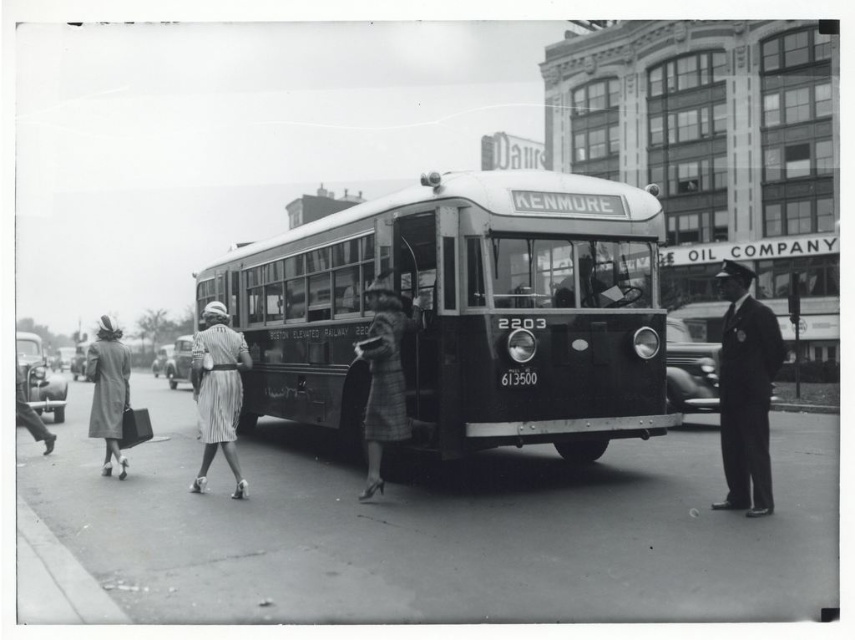
Based on the photo, you are a fashion designer observing the urban scene. You notice the plaid wool skirt at center and the matte gray coat at left. Which clothing item appears taller in the photograph?

The plaid wool skirt at center is taller than the matte gray coat at left according to the description.

You are a delivery person trying to park your 1.5 meter wide delivery van between the metallic silver bus at center and the matte gray coat at left. Can you fit your van there?

The metallic silver bus at center might be wider than matte gray coat at left. Since the exact width difference is unclear, it is uncertain whether the space between them is sufficient for your 1.5 meter wide delivery van. You should measure the space carefully before attempting to park.